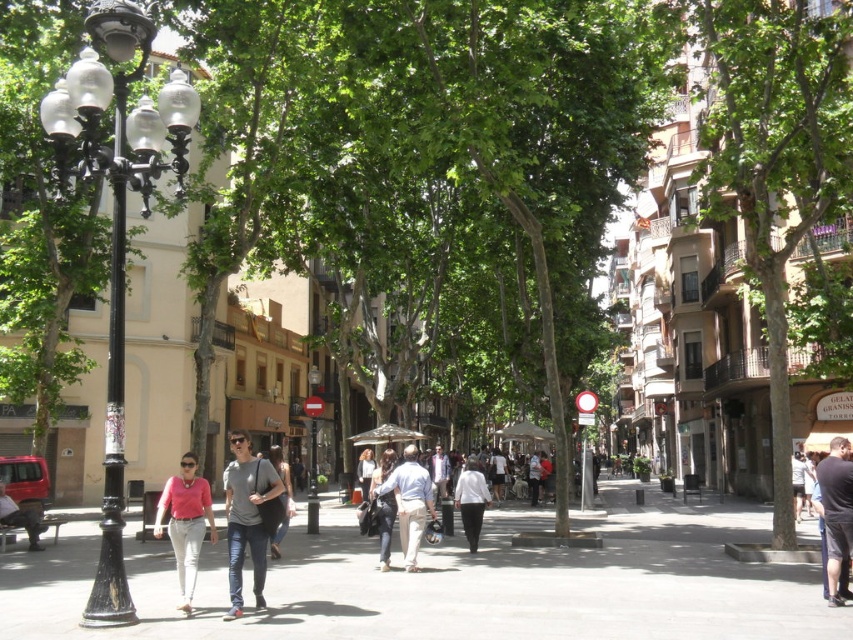
You are a street artist planning to paint a mural on the black wrought iron lamp post at left and the matte pink shirt at center. Which object will require more paint because of its size?

The black wrought iron lamp post at left is larger in size than the matte pink shirt at center, so it will require more paint.

You are standing at the starting point of the street and see two points marked on the ground ahead of you. The first point is labeled as point (x=183, y=179) and the second as point (x=177, y=545). According to the coordinates, which point is closer to your current position?

Point (x=177, y=545) is closer to your current position because it is in front of point (x=183, y=179), which is behind it.